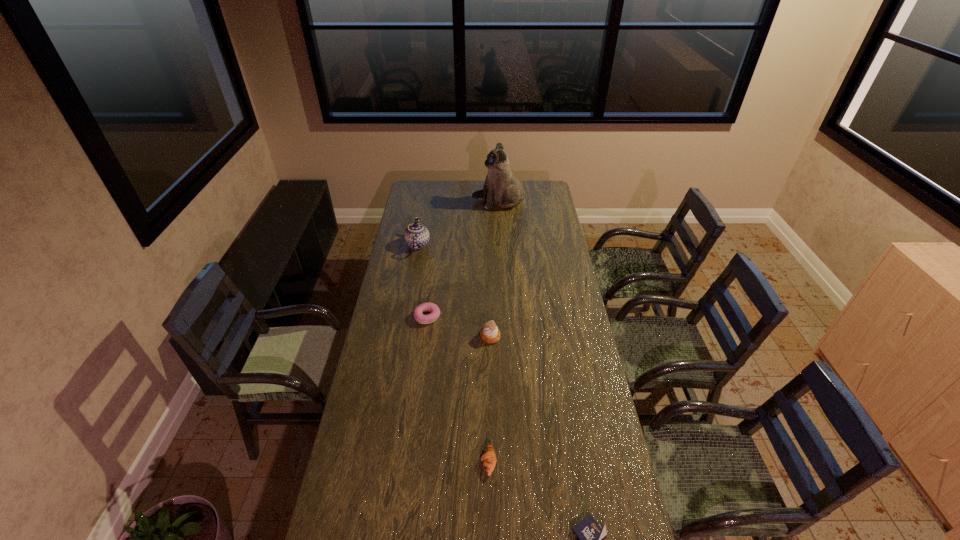
Where is `pastry that is at the left edge`? Image resolution: width=960 pixels, height=540 pixels. pastry that is at the left edge is located at coordinates (418, 312).

Image resolution: width=960 pixels, height=540 pixels. I want to click on blank space at the far edge of the desktop, so click(452, 181).

Find the location of a particular element. This screenshot has height=540, width=960. vacant space at the left edge of the desktop is located at coordinates (382, 523).

I want to click on vacant space at the right edge, so click(633, 534).

Where is `free space at the far right corner of the desktop`? The height and width of the screenshot is (540, 960). free space at the far right corner of the desktop is located at coordinates (551, 197).

Find the location of a particular element. free space between the second farthest pastry and the chinaware is located at coordinates (454, 291).

This screenshot has width=960, height=540. Identify the location of free space between the nearest pastry and the third farthest object. (458, 389).

At what (x,y) coordinates should I click in order to perform the action: click on free space between the tallest object and the leftmost pastry. Please return your answer as a coordinate pair (x, y). The image size is (960, 540). Looking at the image, I should click on (463, 259).

Locate an element on the screen. This screenshot has height=540, width=960. vacant space that is in between the tallest object and the fourth nearest object is located at coordinates (463, 259).

Identify the location of vacant region between the nearest pastry and the second farthest pastry. (490, 399).